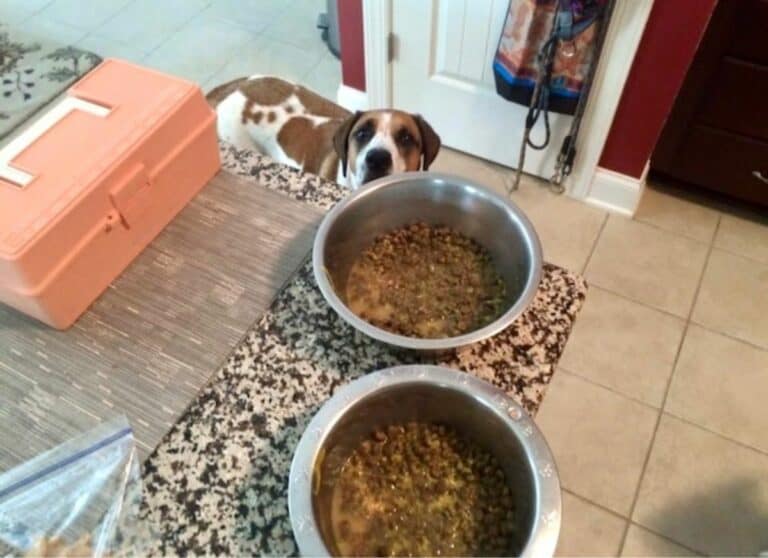
Where is `metal bowl`? metal bowl is located at coordinates (528, 244), (540, 461).